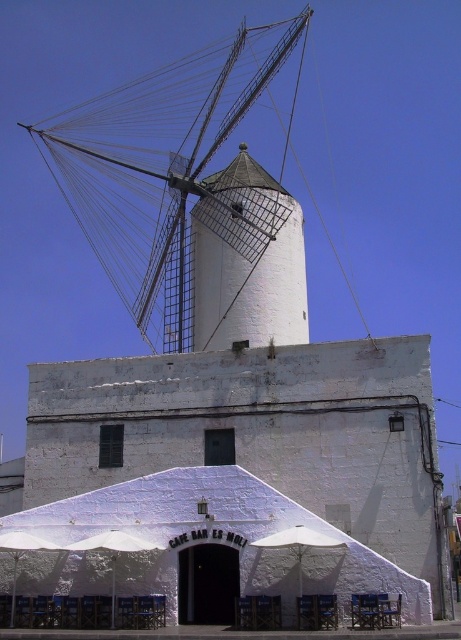
You are a customer looking to sit under the shade. The white fabric umbrella at lower center provides shade, but you want to know if the white painted wood windmill at upper center also casts a shadow over the area. Can you determine this based on the scene?

The white painted wood windmill at upper center is larger in size compared to the white fabric umbrella at lower center. However, the windmill is located at the upper center, while the umbrella is at the lower center. Since the windmill is above the umbrella, its shadow would likely fall behind or around the umbrella, but not directly over the seating area under the umbrella. Therefore, the windmill does not cast a shadow over the white fabric umbrella at lower center.

You are a customer sitting at the lower center of the image and want to take a photo of the white painted wood windmill at upper center. Since the white fabric umbrella at lower center is blocking your view, can you move the umbrella to the right to get a clear shot?

The white painted wood windmill at upper center is positioned on the left side of the white fabric umbrella at lower center. Moving the umbrella to the right would allow you to see the windmill without obstruction.

You are standing at the camera position and want to take a photo of the white painted wood windmill at upper center. The camera has a maximum zoom range of 50 meters. Can you capture the windmill in your photo without moving closer?

The white painted wood windmill at upper center and camera are 66.56 meters apart from each other. Since the maximum zoom is 50 meters, the camera cannot capture the windmill at this distance without moving closer.